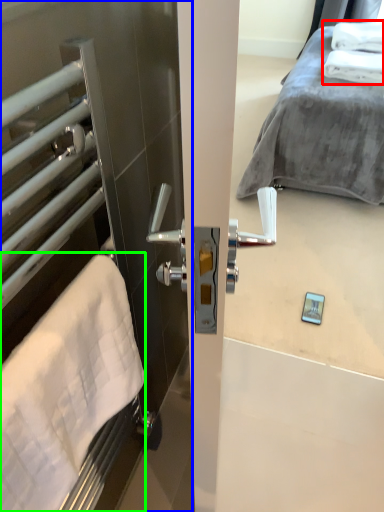
Question: Estimate the real-world distances between objects in this image. Which object is closer to bath towel (highlighted by a red box), screen door (highlighted by a blue box) or bath towel (highlighted by a green box)?

Choices:
 (A) screen door
 (B) bath towel

Answer: (A)